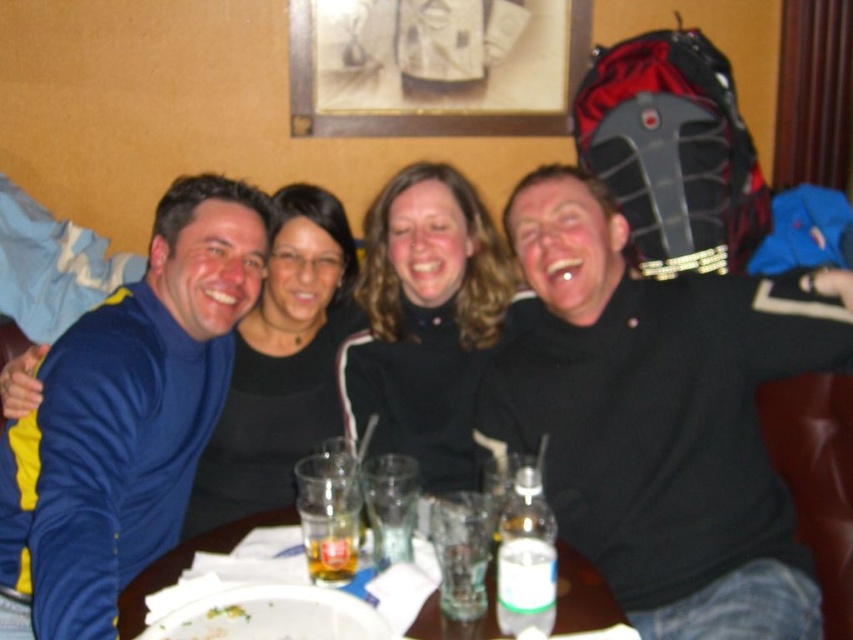
Question: Which of the following is the closest to the observer?

Choices:
 (A) black textured sweater at right
 (B) transparent glassware at center
 (C) blue fleece jacket at left

Answer: (C)

Question: Which point appears farthest from the camera in this image?

Choices:
 (A) (148, 337)
 (B) (563, 602)
 (C) (589, 333)

Answer: (C)

Question: In this image, where is black textured sweater at right located relative to blue fleece jacket at left?

Choices:
 (A) left
 (B) right

Answer: (B)

Question: Does black textured sweater at right lie behind blue fleece jacket at left?

Choices:
 (A) no
 (B) yes

Answer: (B)

Question: Which point is closer to the camera?

Choices:
 (A) transparent glassware at center
 (B) black textured sweater at right

Answer: (A)

Question: Does black textured sweater at right appear over transparent glassware at center?

Choices:
 (A) yes
 (B) no

Answer: (A)